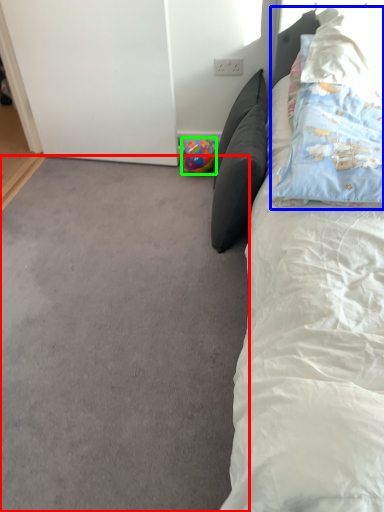
Question: Which is farther away from plain (highlighted by a red box)? pillow (highlighted by a blue box) or toy (highlighted by a green box)?

Choices:
 (A) pillow
 (B) toy

Answer: (B)